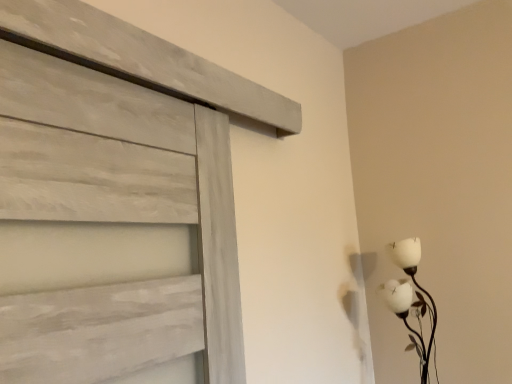
What are the coordinates of `white matte table lamp at right` in the screenshot? It's located at (411, 300).

Describe the element at coordinates (411, 300) in the screenshot. I see `white matte table lamp at right` at that location.

Find the location of a particular element. white matte table lamp at right is located at coordinates (411, 300).